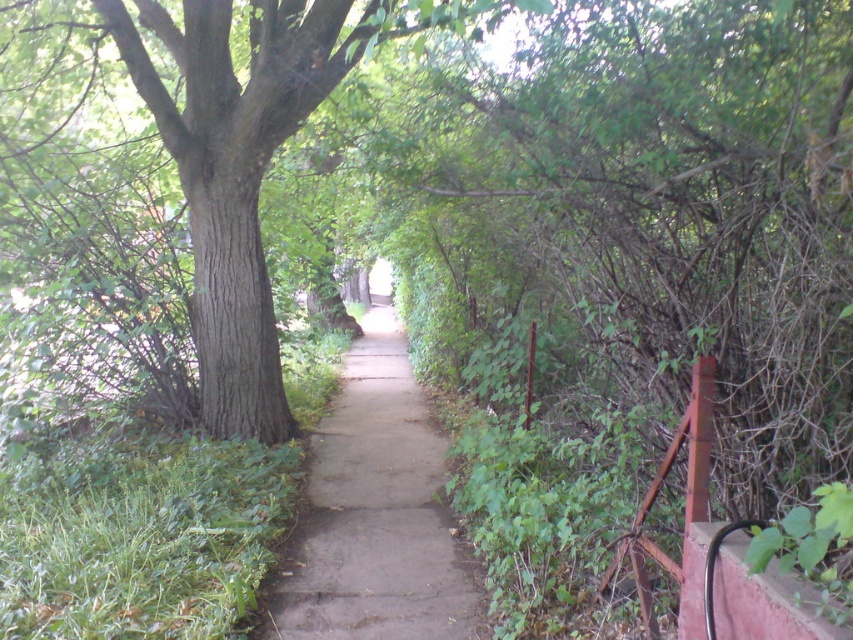
You are standing at the start of the pathway and want to reach the end. There are two points marked on the path, point [296,77] and point [332,468]. Which point will you encounter first as you walk along the path?

Point [296,77] is closer to the viewer than point [332,468], so you will encounter point [296,77] first as you walk along the path.

You are a hiker carrying a heavy backpack and need to rest. You see the green rough bark tree at center and the dull concrete pavement at center. Which one would provide a more stable surface to sit on?

The dull concrete pavement at center is a more stable surface to sit on because it is a solid structure, while the green rough bark tree at center has rough bark and is a living tree, making it less suitable for sitting.

You are a delivery robot with a 3.5 feet wide base. You need to navigate through the narrow pathway shown in the image. Can you safely pass between the green rough bark tree at center and the dull concrete pavement at center without touching either?

The distance between the green rough bark tree at center and the dull concrete pavement at center is 6.85 feet. Since the robot is 3.5 feet wide, there is enough space to pass safely between them.